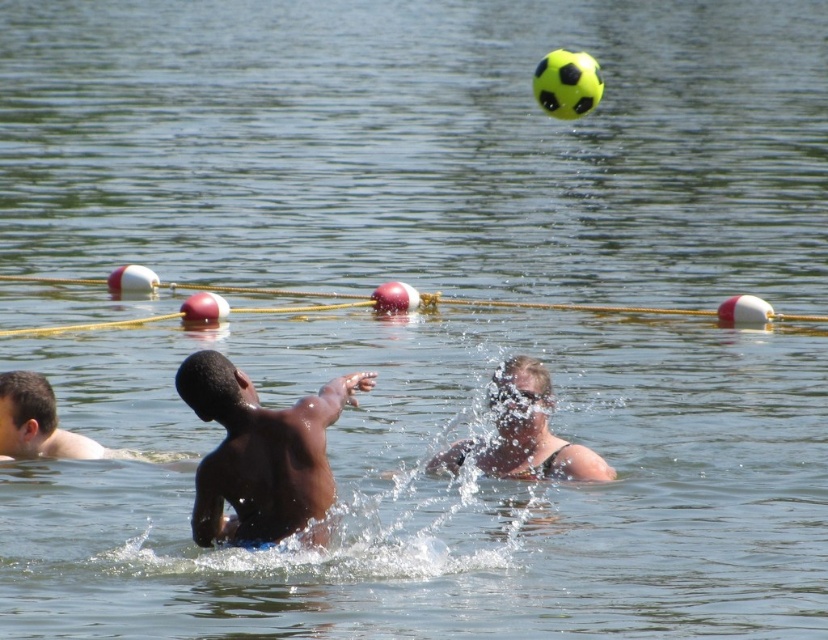
Based on the scene description, what is located at the coordinates point (260, 452)?

The dark skin human at center is located at point (260, 452).

You are a photographer trying to capture a photo of the smooth skin man at center and the light brown skin at lower left. Since you want to ensure both are visible in the frame, which person should you position closer to the camera to avoid them being blocked by the other?

The smooth skin man at center is much taller than the light brown skin at lower left, so you should position the light brown skin at lower left closer to the camera to prevent the taller smooth skin man at center from blocking them.